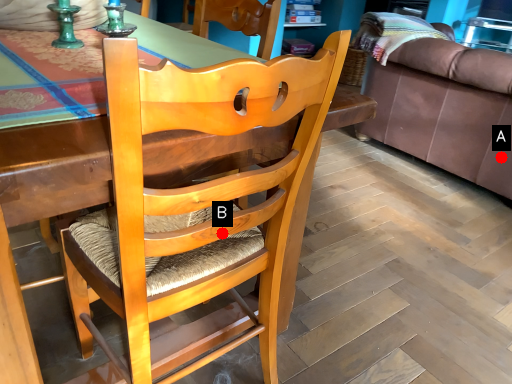
Question: Two points are circled on the image, labeled by A and B beside each circle. Which point is closer to the camera taking this photo?

Choices:
 (A) A is closer
 (B) B is closer

Answer: (B)